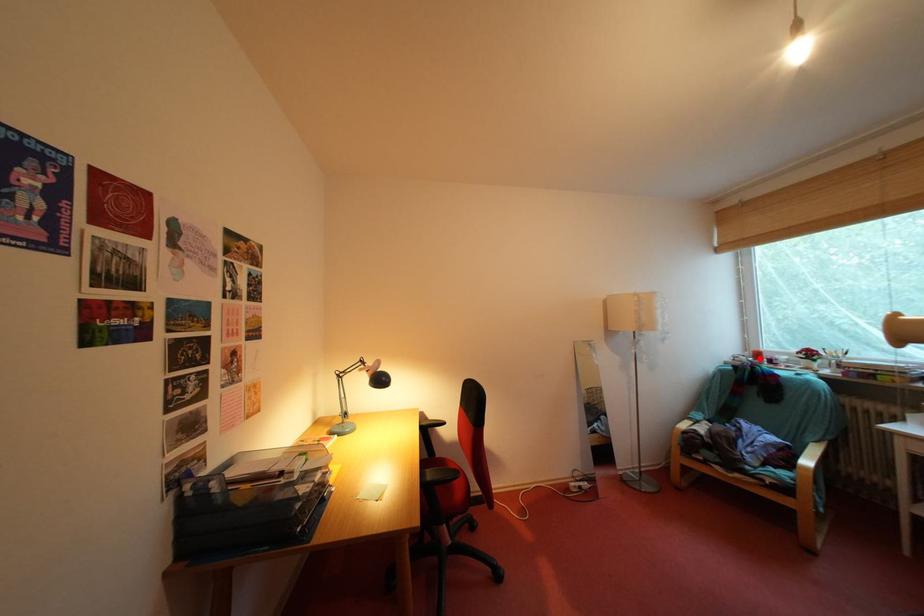
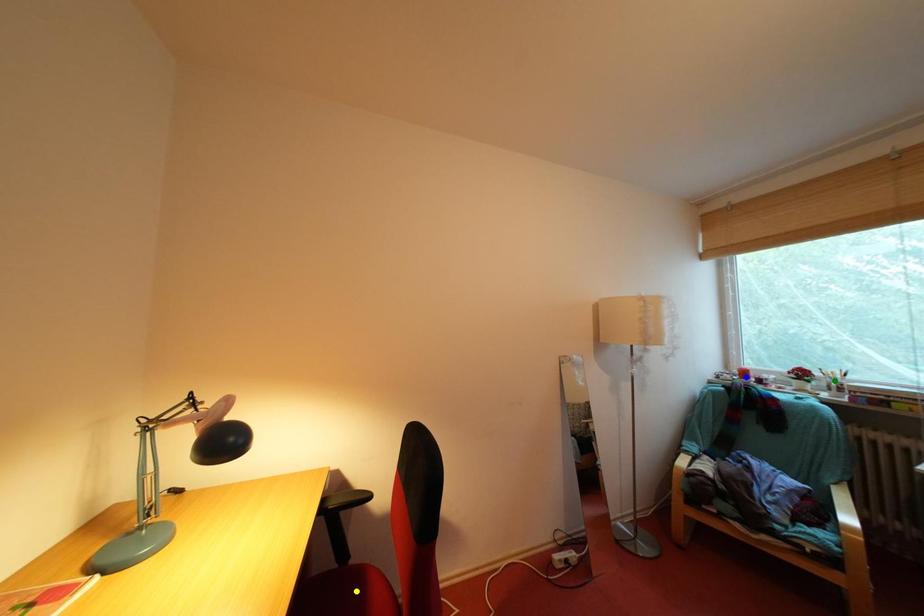
Question: I am providing you with two images of the same scene from different viewpoints. A red point is marked on the first image. You are given multiple points on the second image. Which point in image 2 represents the same 3d spot as the red point in image 1?

Choices:
 (A) blue point
 (B) green point
 (C) yellow point

Answer: (A)